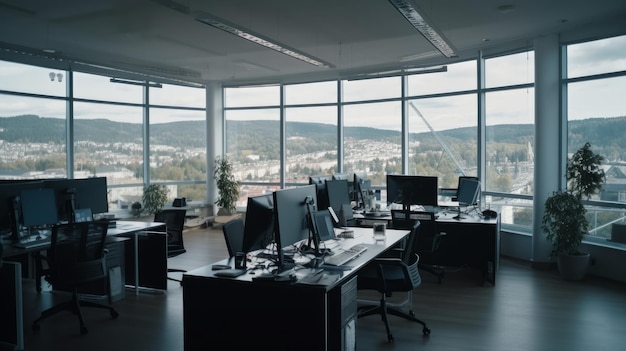
You are a GUI agent. You are given a task and a screenshot of the screen. Output one action in this format:
    pyautogui.click(x=<x>, y=<y>)
    Task: Click on the large windows on left side of room
    
    Given the screenshot: What is the action you would take?
    pyautogui.click(x=57, y=144), pyautogui.click(x=104, y=141), pyautogui.click(x=188, y=147)